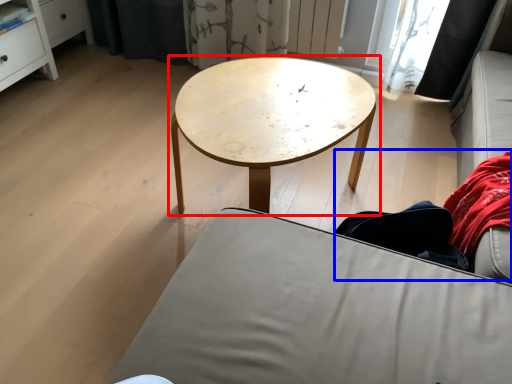
Question: Which object appears farthest to the camera in this image, coffee table (highlighted by a red box) or couple (highlighted by a blue box)?

Choices:
 (A) coffee table
 (B) couple

Answer: (A)